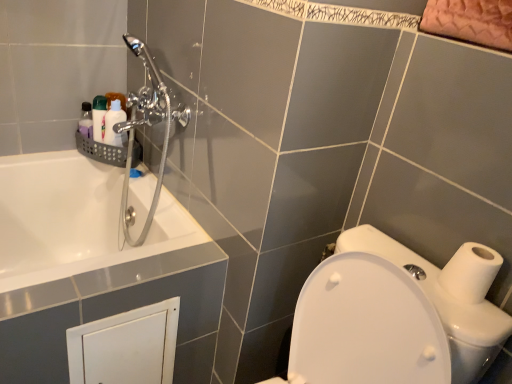
This screenshot has height=384, width=512. In order to click on vacant area in front of white matte toilet paper at right in this screenshot , I will do `click(467, 322)`.